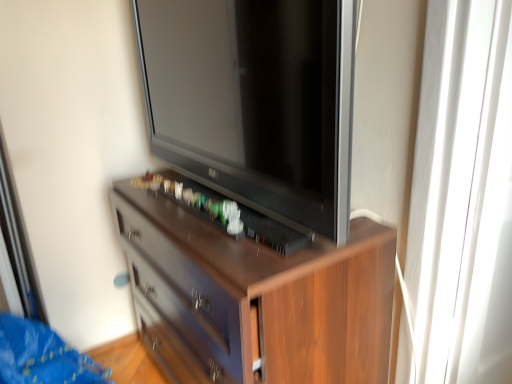
Question: From the image's perspective, is satin black television at center under brown wood chest of drawers at center?

Choices:
 (A) no
 (B) yes

Answer: (A)

Question: Is satin black television at center smaller than brown wood chest of drawers at center?

Choices:
 (A) no
 (B) yes

Answer: (B)

Question: Is satin black television at center surrounding brown wood chest of drawers at center?

Choices:
 (A) yes
 (B) no

Answer: (B)

Question: Considering the relative sizes of satin black television at center and brown wood chest of drawers at center in the image provided, is satin black television at center thinner than brown wood chest of drawers at center?

Choices:
 (A) no
 (B) yes

Answer: (B)

Question: Is brown wood chest of drawers at center at the back of satin black television at center?

Choices:
 (A) yes
 (B) no

Answer: (B)

Question: From the image's perspective, is brown wood chest of drawers at center positioned above or below satin black television at center?

Choices:
 (A) above
 (B) below

Answer: (B)

Question: Is brown wood chest of drawers at center spatially inside satin black television at center, or outside of it?

Choices:
 (A) inside
 (B) outside

Answer: (B)

Question: Looking at the image, does brown wood chest of drawers at center seem bigger or smaller compared to satin black television at center?

Choices:
 (A) small
 (B) big

Answer: (B)

Question: Does point (221, 251) appear closer or farther from the camera than point (281, 76)?

Choices:
 (A) closer
 (B) farther

Answer: (B)

Question: In terms of size, does satin black television at center appear bigger or smaller than brown wood chest of drawers at center?

Choices:
 (A) big
 (B) small

Answer: (B)

Question: In terms of height, does satin black television at center look taller or shorter compared to brown wood chest of drawers at center?

Choices:
 (A) tall
 (B) short

Answer: (B)

Question: Is satin black television at center spatially inside brown wood chest of drawers at center, or outside of it?

Choices:
 (A) outside
 (B) inside

Answer: (A)

Question: From a real-world perspective, is satin black television at center physically located above or below brown wood chest of drawers at center?

Choices:
 (A) above
 (B) below

Answer: (A)

Question: In the image, is transparent glass door at right on the left side or the right side of satin black television at center?

Choices:
 (A) right
 (B) left

Answer: (A)

Question: Is transparent glass door at right in front of or behind satin black television at center in the image?

Choices:
 (A) behind
 (B) front

Answer: (A)